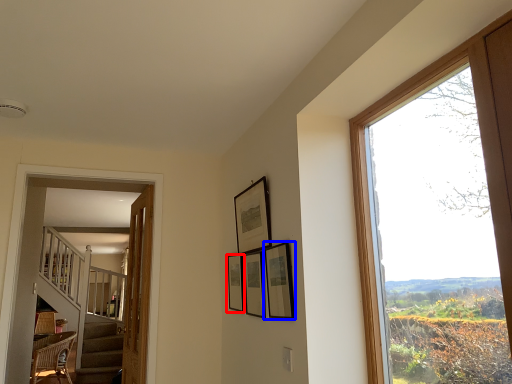
Question: Among these objects, which one is nearest to the camera, picture frame (highlighted by a red box) or picture frame (highlighted by a blue box)?

Choices:
 (A) picture frame
 (B) picture frame

Answer: (B)